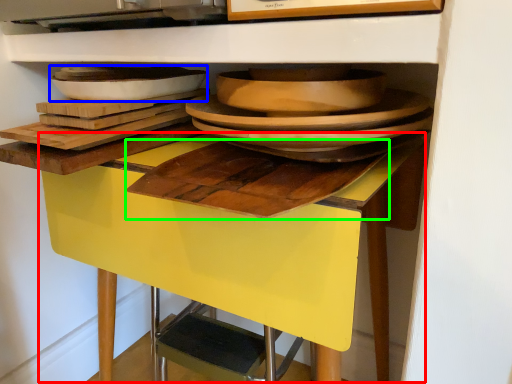
Question: Which object is the closest to the table (highlighted by a red box)? Choose among these: platter (highlighted by a blue box) or cutting board (highlighted by a green box).

Choices:
 (A) platter
 (B) cutting board

Answer: (B)